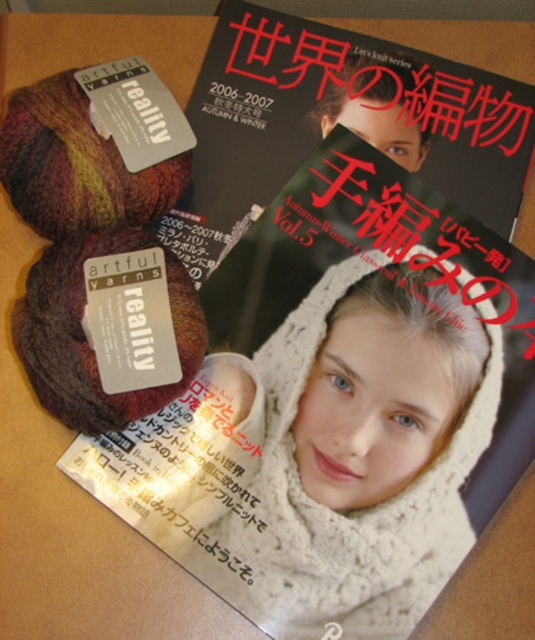
Question: Among these points, which one is farthest from the camera?

Choices:
 (A) (393, 387)
 (B) (523, 152)

Answer: (B)

Question: Does white knitted scarf at center have a lesser width compared to matte black magazine at upper center?

Choices:
 (A) yes
 (B) no

Answer: (A)

Question: Can you confirm if white knitted scarf at center is bigger than matte black magazine at upper center?

Choices:
 (A) yes
 (B) no

Answer: (A)

Question: Can you confirm if white knitted scarf at center is bigger than matte black magazine at upper center?

Choices:
 (A) yes
 (B) no

Answer: (A)